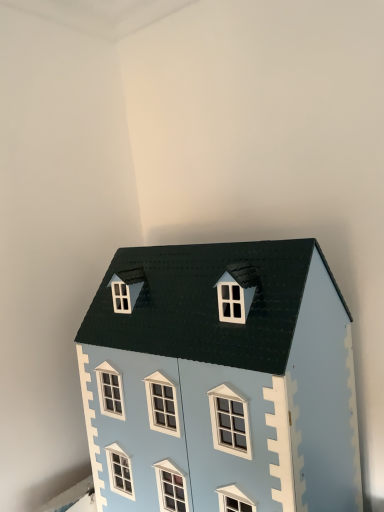
What do you see at coordinates (221, 381) in the screenshot? I see `light blue matte house at center` at bounding box center [221, 381].

The image size is (384, 512). What are the coordinates of `light blue matte house at center` in the screenshot? It's located at (221, 381).

Where is `light blue matte house at center`? This screenshot has height=512, width=384. light blue matte house at center is located at coordinates (x=221, y=381).